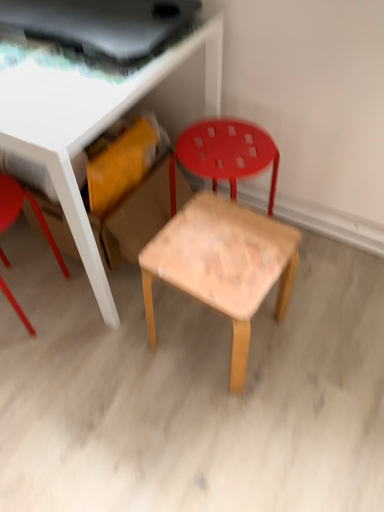
Question: Is matte red stool at left, which is the 1th chair from left to right, completely or partially outside of wooden table at center?

Choices:
 (A) yes
 (B) no

Answer: (B)

Question: Is matte red stool at left, which is the 1th chair from left to right, looking in the opposite direction of wooden table at center?

Choices:
 (A) yes
 (B) no

Answer: (B)

Question: Does matte red stool at left, which is the 1th chair from left to right, turn towards wooden table at center?

Choices:
 (A) no
 (B) yes

Answer: (B)

Question: Considering the relative sizes of matte red stool at left, which is the 1th chair from left to right, and wooden table at center in the image provided, is matte red stool at left, which is the 1th chair from left to right, wider than wooden table at center?

Choices:
 (A) no
 (B) yes

Answer: (A)

Question: Does matte red stool at left, which is the 2th chair from right to left, have a lesser height compared to wooden table at center?

Choices:
 (A) yes
 (B) no

Answer: (A)

Question: Does matte red stool at left, which is the 1th chair from left to right, appear on the right side of wooden table at center?

Choices:
 (A) no
 (B) yes

Answer: (A)

Question: Considering the relative sizes of wooden chair at center, which is the 1th chair in right-to-left order, and wooden table at center in the image provided, is wooden chair at center, which is the 1th chair in right-to-left order, shorter than wooden table at center?

Choices:
 (A) no
 (B) yes

Answer: (B)

Question: Is wooden chair at center, marked as the second chair in a left-to-right arrangement, behind wooden table at center?

Choices:
 (A) yes
 (B) no

Answer: (A)

Question: Considering the relative sizes of wooden chair at center, marked as the second chair in a left-to-right arrangement, and wooden table at center in the image provided, is wooden chair at center, marked as the second chair in a left-to-right arrangement, taller than wooden table at center?

Choices:
 (A) yes
 (B) no

Answer: (B)

Question: Considering the relative positions of wooden chair at center, marked as the second chair in a left-to-right arrangement, and wooden table at center in the image provided, is wooden chair at center, marked as the second chair in a left-to-right arrangement, to the right of wooden table at center from the viewer's perspective?

Choices:
 (A) no
 (B) yes

Answer: (B)

Question: Is wooden chair at center, which is the 1th chair in right-to-left order, wider than wooden table at center?

Choices:
 (A) yes
 (B) no

Answer: (B)

Question: Is there a large distance between wooden chair at center, marked as the second chair in a left-to-right arrangement, and wooden table at center?

Choices:
 (A) yes
 (B) no

Answer: (B)

Question: Is wooden table at center not inside natural wood stool at center?

Choices:
 (A) yes
 (B) no

Answer: (A)